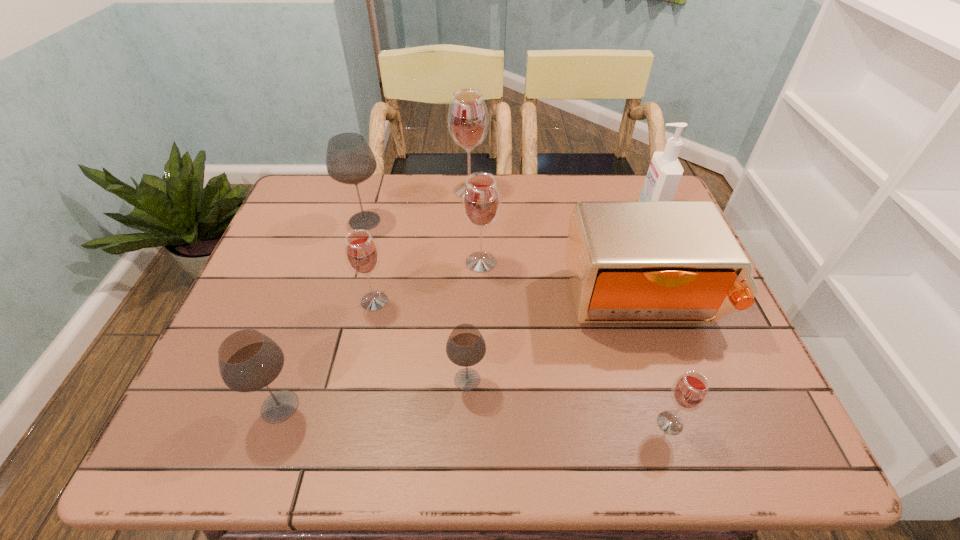
Image resolution: width=960 pixels, height=540 pixels. What are the coordinates of `object that is at the far right corner` in the screenshot? It's located at (665, 171).

Identify the location of vacant space at the far edge of the desktop. The width and height of the screenshot is (960, 540). (384, 177).

Locate an element on the screen. The width and height of the screenshot is (960, 540). free space at the near edge of the desktop is located at coordinates (294, 435).

Find the location of a particular element. The width and height of the screenshot is (960, 540). vacant space at the left edge of the desktop is located at coordinates (314, 258).

The image size is (960, 540). I want to click on vacant space at the right edge, so click(x=733, y=410).

In the image, there is a desktop. In order to click on vacant space at the far left corner in this screenshot , I will do `click(295, 206)`.

Find the location of a particular element. The width and height of the screenshot is (960, 540). free spot between the tallest wineglass and the sixth nearest wineglass is located at coordinates (418, 206).

Find the location of `vacant point located between the second smallest gray wineglass and the cleansing agent`. vacant point located between the second smallest gray wineglass and the cleansing agent is located at coordinates (466, 309).

The image size is (960, 540). Identify the location of empty space that is in between the fourth nearest wineglass and the third farthest wineglass. (427, 282).

Identify the location of free space between the white toaster oven and the second biggest red wineglass. The height and width of the screenshot is (540, 960). (562, 282).